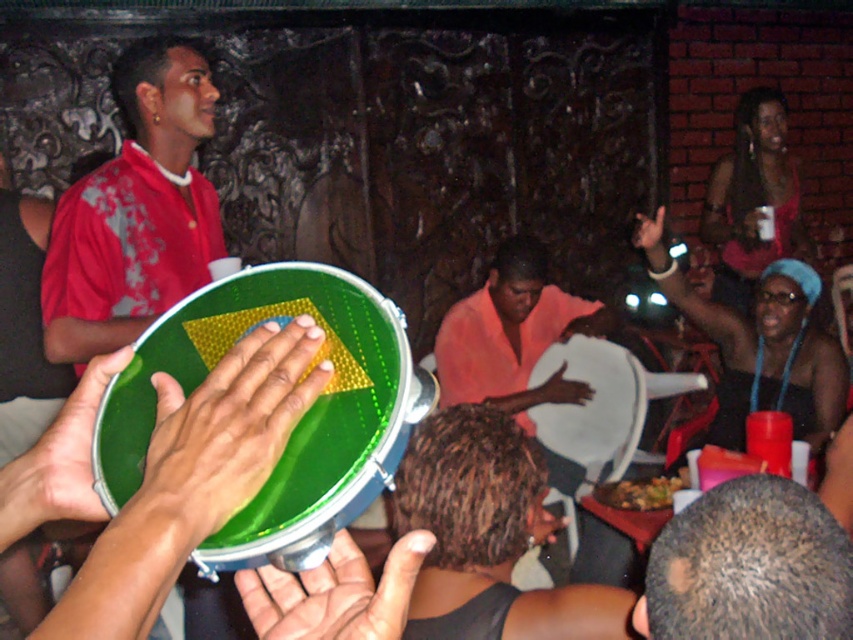
Question: Which point is farther to the camera?

Choices:
 (A) (544, 385)
 (B) (338, 579)
 (C) (712, 301)

Answer: (C)

Question: Can you confirm if red floral shirt at upper left is positioned above green rubber drum at center?

Choices:
 (A) no
 (B) yes

Answer: (B)

Question: Is matte black tambourine at center thinner than green glossy tambourine at center?

Choices:
 (A) no
 (B) yes

Answer: (A)

Question: Among these points, which one is farthest from the camera?

Choices:
 (A) (277, 422)
 (B) (82, 312)

Answer: (B)

Question: Is red floral shirt at upper left bigger than dark brown fur at center?

Choices:
 (A) yes
 (B) no

Answer: (A)

Question: Among these objects, which one is nearest to the camera?

Choices:
 (A) red floral shirt at upper left
 (B) green glossy tambourine at center
 (C) green matte tambourine at center

Answer: (C)